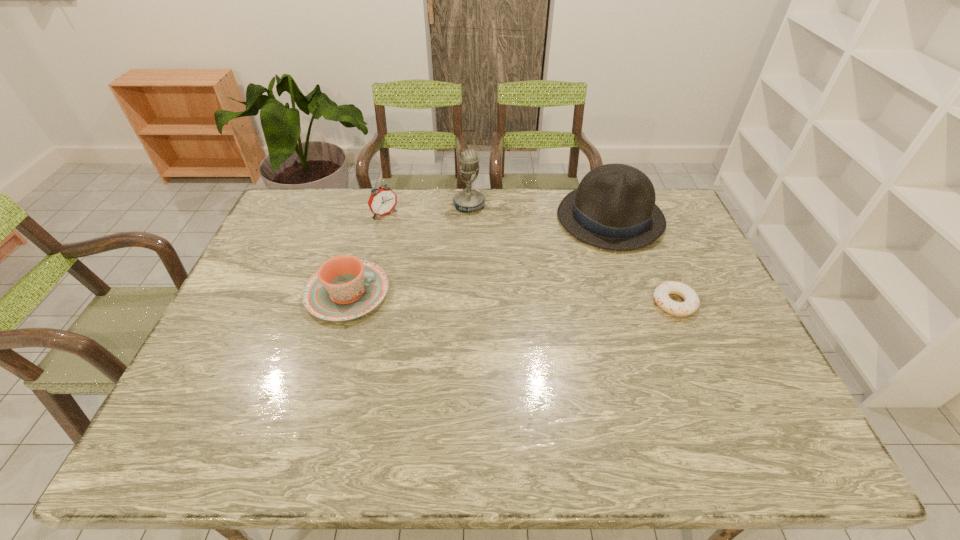
This screenshot has width=960, height=540. I want to click on doughnut located at the right edge, so [691, 302].

Image resolution: width=960 pixels, height=540 pixels. I want to click on bowler hat that is at the right edge, so click(x=614, y=208).

You are a GUI agent. You are given a task and a screenshot of the screen. Output one action in this format:
    pyautogui.click(x=<x>, y=<y>)
    Task: Click on the object that is at the far right corner
    
    Given the screenshot: What is the action you would take?
    pyautogui.click(x=614, y=208)

In order to click on free spot at the far edge of the desktop in this screenshot , I will do `click(389, 225)`.

This screenshot has width=960, height=540. Find the location of `vacant space at the near edge of the desktop`. vacant space at the near edge of the desktop is located at coordinates (279, 398).

Locate an element on the screen. Image resolution: width=960 pixels, height=540 pixels. vacant space at the left edge of the desktop is located at coordinates (248, 273).

Find the location of `free region at the right edge`. free region at the right edge is located at coordinates (719, 289).

This screenshot has width=960, height=540. Identify the location of vacant space at the near left corner of the desktop. (218, 389).

This screenshot has width=960, height=540. Find the location of `vacant space at the near right corner`. vacant space at the near right corner is located at coordinates (716, 388).

The height and width of the screenshot is (540, 960). I want to click on vacant area that lies between the third shortest object and the fourth shortest object, so click(497, 216).